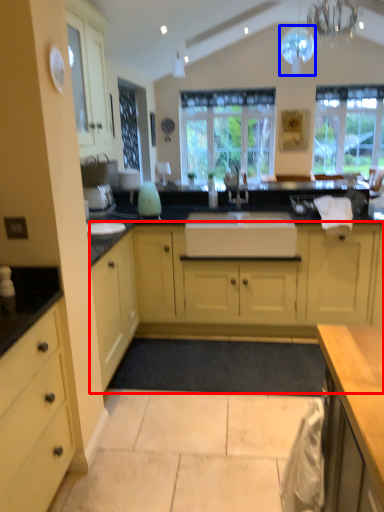
Question: Which point is closer to the camera, cabinetry (highlighted by a red box) or light fixture (highlighted by a blue box)?

Choices:
 (A) cabinetry
 (B) light fixture

Answer: (A)